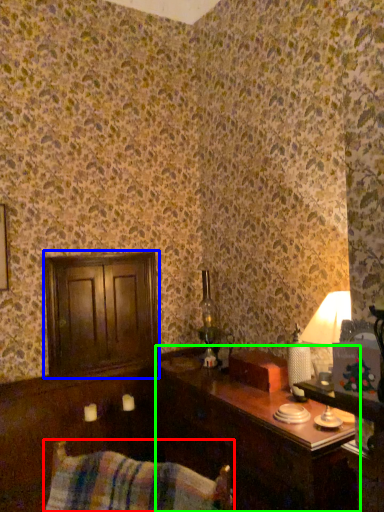
Question: Considering the real-world distances, which object is closest to swivel chair (highlighted by a red box)? dresser (highlighted by a blue box) or table (highlighted by a green box).

Choices:
 (A) dresser
 (B) table

Answer: (B)